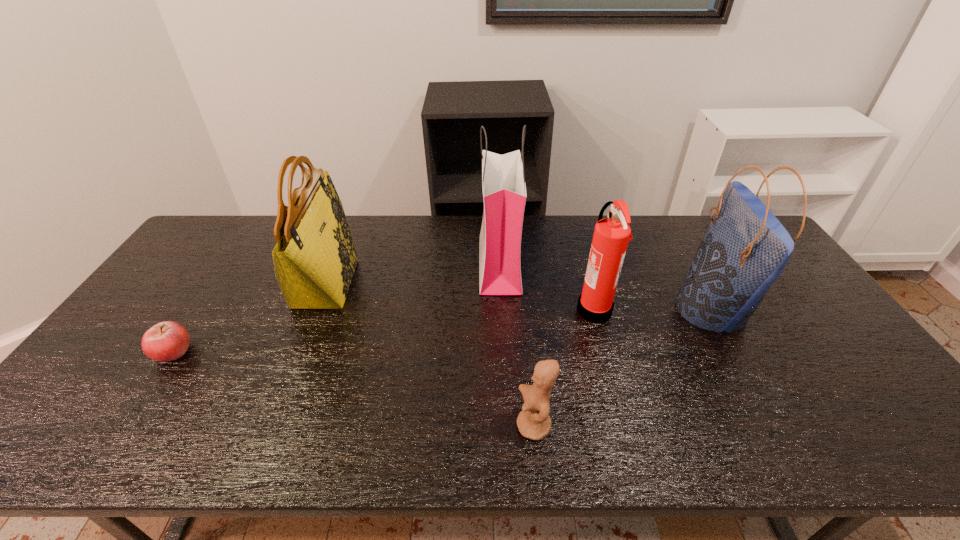
The image size is (960, 540). Find the location of `vacant point that satisfies the following two spatial constraints: 1. with the nozzle aimed from the right shopping bag; 2. on the left side of the fifth object from left to right`. vacant point that satisfies the following two spatial constraints: 1. with the nozzle aimed from the right shopping bag; 2. on the left side of the fifth object from left to right is located at coordinates (593, 310).

Locate an element on the screen. free location that satisfies the following two spatial constraints: 1. on the back side of the right shopping bag; 2. on the front-facing side of the tote bag is located at coordinates (697, 284).

Where is `free spot that satisfies the following two spatial constraints: 1. on the back side of the rightmost object; 2. with the nozzle aimed from the fire extinguisher`? free spot that satisfies the following two spatial constraints: 1. on the back side of the rightmost object; 2. with the nozzle aimed from the fire extinguisher is located at coordinates (711, 309).

The image size is (960, 540). Find the location of `vacant space that satisfies the following two spatial constraints: 1. on the front-facing side of the rightmost object; 2. on the left side of the tote bag`. vacant space that satisfies the following two spatial constraints: 1. on the front-facing side of the rightmost object; 2. on the left side of the tote bag is located at coordinates (316, 310).

I want to click on vacant space that satisfies the following two spatial constraints: 1. on the front-facing side of the right shopping bag; 2. on the right side of the left shopping bag, so click(x=502, y=310).